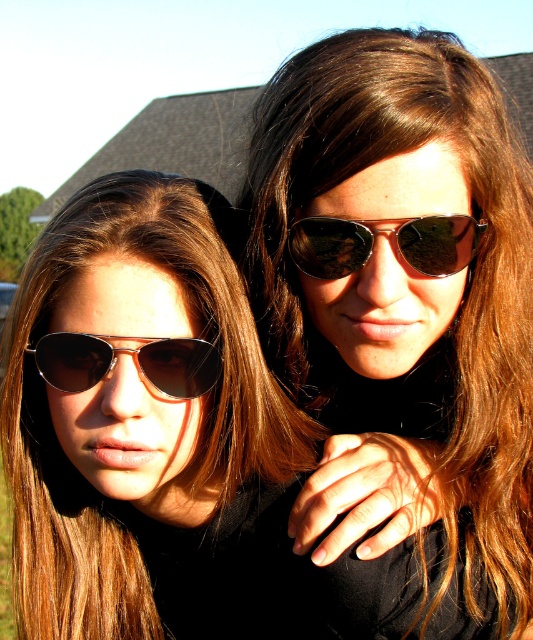
You are a photographer adjusting lighting for a portrait. You notice the brown shiny hair at upper right and the metallic aviator sunglasses at center in your frame. Which object is taller in the image?

The brown shiny hair at upper right has a greater height compared to the metallic aviator sunglasses at center, so the brown shiny hair at upper right is taller.

You are a photographer standing at the camera position. You want to take a closeup shot of the brown shiny hair at left. Considering the distance between you and the hair is 4.11 feet, is this distance suitable for a typical portrait shot?

The distance between the brown shiny hair at left and the camera is 4.11 feet. For a typical portrait shot, this distance is suitable as it allows capturing facial details while maintaining a flattering perspective.